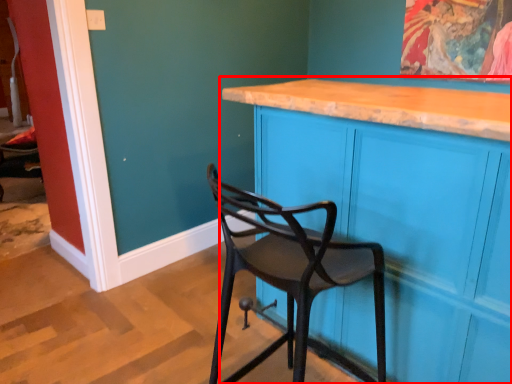
Question: Considering the relative positions of cabinetry (annotated by the red box) and chair in the image provided, where is cabinetry (annotated by the red box) located with respect to the staircase?

Choices:
 (A) right
 (B) left

Answer: (A)